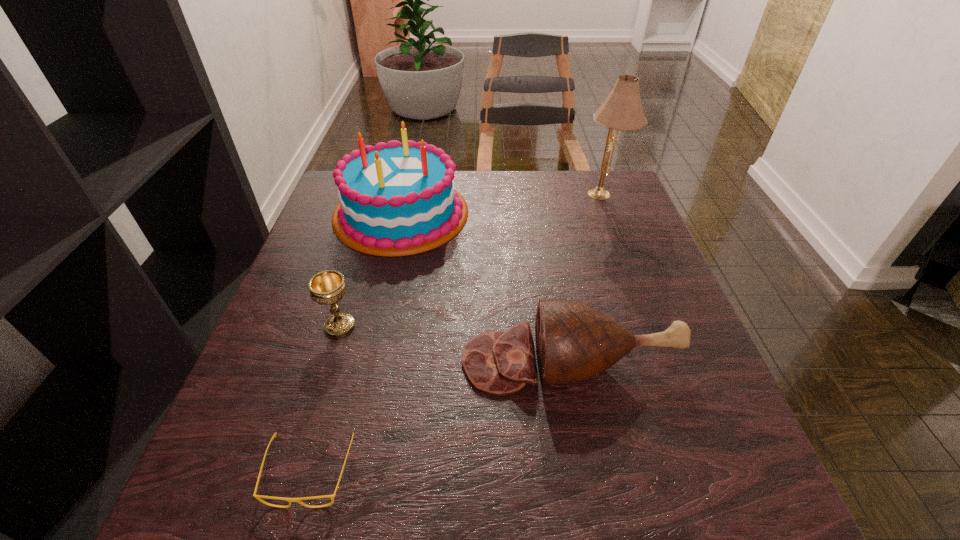
Identify the location of object that is positioned at the far left corner. (396, 199).

This screenshot has height=540, width=960. I want to click on object present at the near left corner, so click(x=258, y=497).

Where is `object positioned at the far right corner`? The image size is (960, 540). object positioned at the far right corner is located at coordinates (622, 110).

In the image, there is a desktop. In order to click on vacant space at the far edge in this screenshot , I will do `click(515, 211)`.

Identify the location of free space at the near edge. The height and width of the screenshot is (540, 960). point(408,469).

Locate an element on the screen. The height and width of the screenshot is (540, 960). vacant space at the left edge is located at coordinates (289, 388).

In order to click on vacant space at the right edge of the desktop in this screenshot , I will do `click(638, 330)`.

This screenshot has height=540, width=960. In order to click on free space at the far right corner in this screenshot , I will do `click(597, 210)`.

Image resolution: width=960 pixels, height=540 pixels. Identify the location of free location at the near right corner. (668, 476).

This screenshot has height=540, width=960. I want to click on vacant point located between the tallest object and the chalice, so click(x=471, y=260).